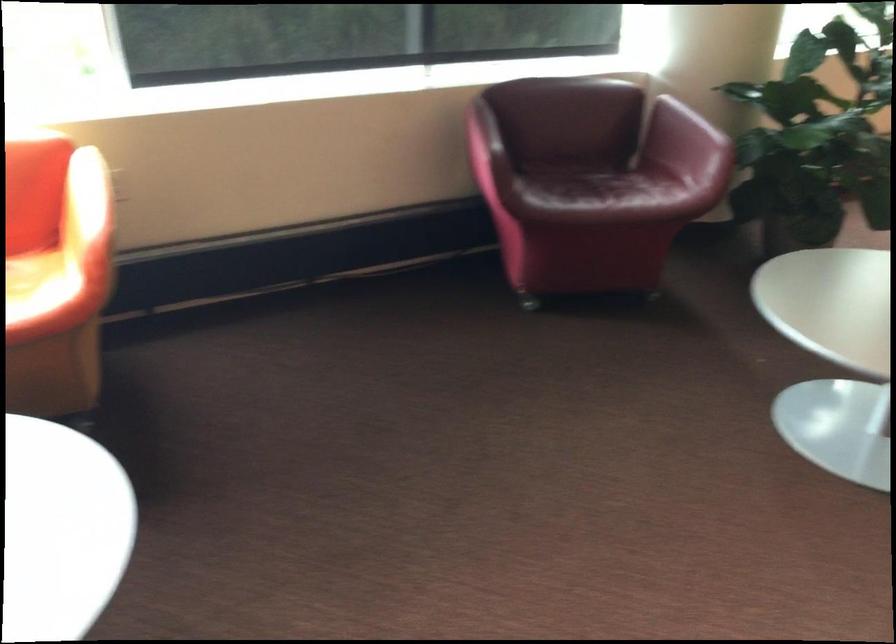
Where would you sit the red chair sitting surface? Please return your answer as a coordinate pair (x, y).

(608, 194)